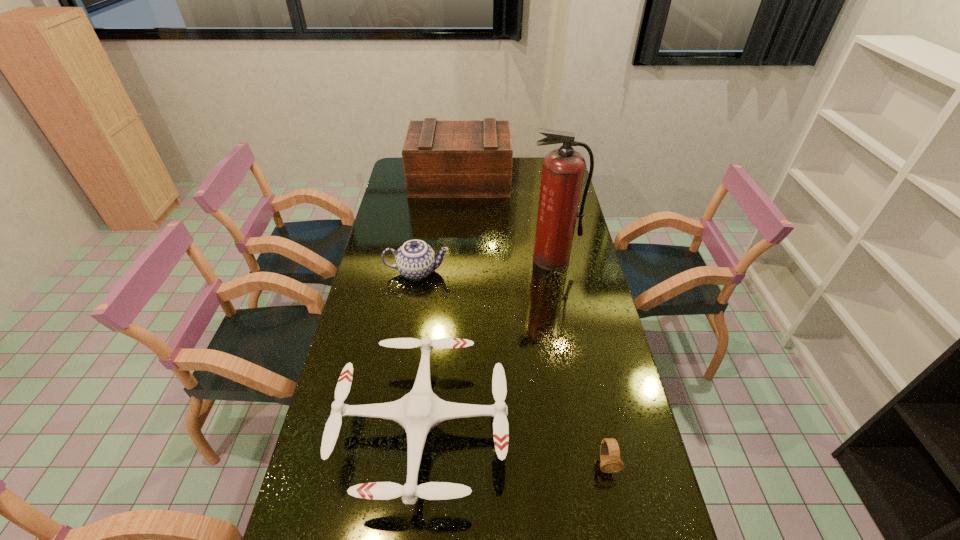
At what (x,y) coordinates should I click in order to perform the action: click on the tallest object. Please return your answer as a coordinate pair (x, y). This screenshot has width=960, height=540. Looking at the image, I should click on (563, 170).

Where is `the second tallest object`? the second tallest object is located at coordinates (441, 158).

The height and width of the screenshot is (540, 960). Find the location of `box`. box is located at coordinates (441, 158).

This screenshot has height=540, width=960. What are the coordinates of `the third tallest object` in the screenshot? It's located at (415, 259).

Image resolution: width=960 pixels, height=540 pixels. Find the location of `drone`. drone is located at coordinates (420, 410).

Find the location of a particular element. The image size is (960, 540). watch is located at coordinates (610, 460).

Locate an element on the screen. Image resolution: width=960 pixels, height=540 pixels. vacant space located 0.260m at the nozzle of the tallest object is located at coordinates (564, 325).

Image resolution: width=960 pixels, height=540 pixels. I want to click on free space located 0.240m on the right of the farthest object, so click(x=560, y=181).

Locate an element on the screen. The height and width of the screenshot is (540, 960). free region located from the spout of the third shortest object is located at coordinates (471, 272).

The width and height of the screenshot is (960, 540). In order to click on vacant space located on the face of the shortest object in this screenshot , I will do `click(621, 536)`.